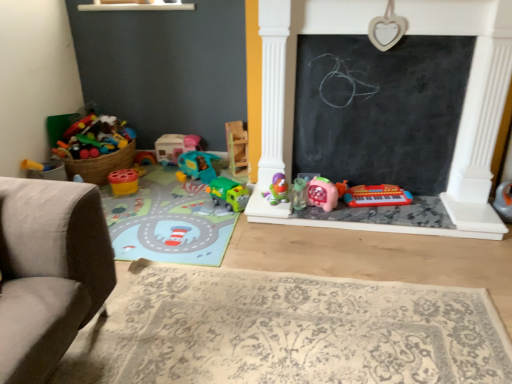
In order to click on free space in front of matte plastic cup at center-left, which is the first toy in left-to-right order in this screenshot , I will do `click(126, 199)`.